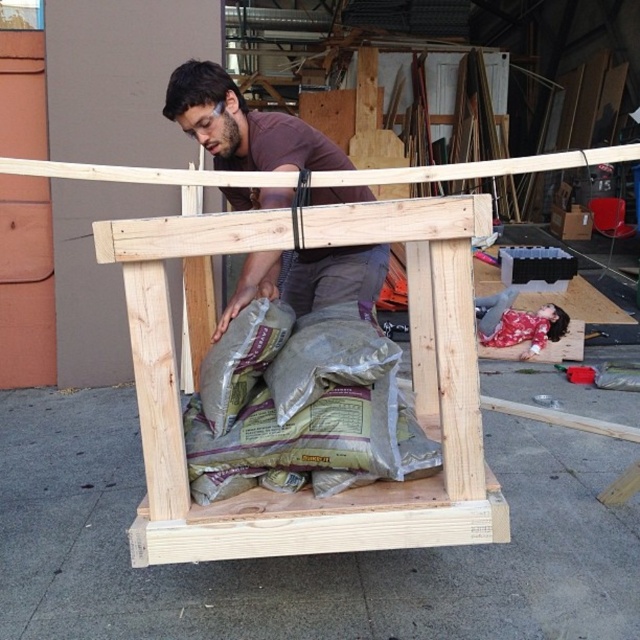
Question: Which object appears farthest from the camera in this image?

Choices:
 (A) brown matte shirt at upper center
 (B) green fabric sacks at center
 (C) natural wood plank at center

Answer: (B)

Question: In this image, where is green fabric sacks at center located relative to brown matte shirt at upper center?

Choices:
 (A) right
 (B) left

Answer: (A)

Question: Is natural wood plank at center positioned in front of brown matte shirt at upper center?

Choices:
 (A) yes
 (B) no

Answer: (A)

Question: Which object appears closest to the camera in this image?

Choices:
 (A) natural wood plank at center
 (B) green fabric sacks at center

Answer: (A)

Question: Is natural wood plank at center smaller than green fabric sacks at center?

Choices:
 (A) yes
 (B) no

Answer: (B)

Question: Among these objects, which one is nearest to the camera?

Choices:
 (A) brown matte shirt at upper center
 (B) green fabric sacks at center
 (C) natural wood plank at center

Answer: (C)